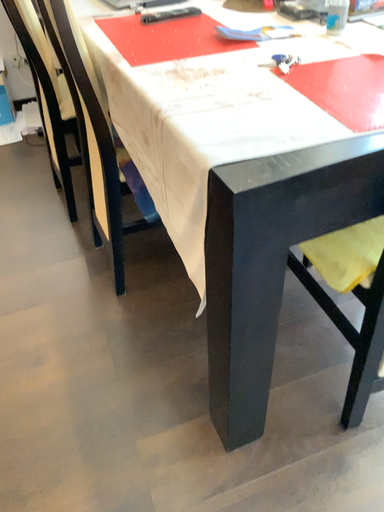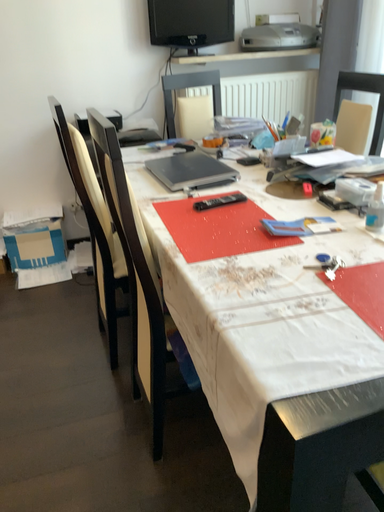
Question: How did the camera likely rotate when shooting the video?

Choices:
 (A) rotated downward
 (B) rotated upward

Answer: (B)